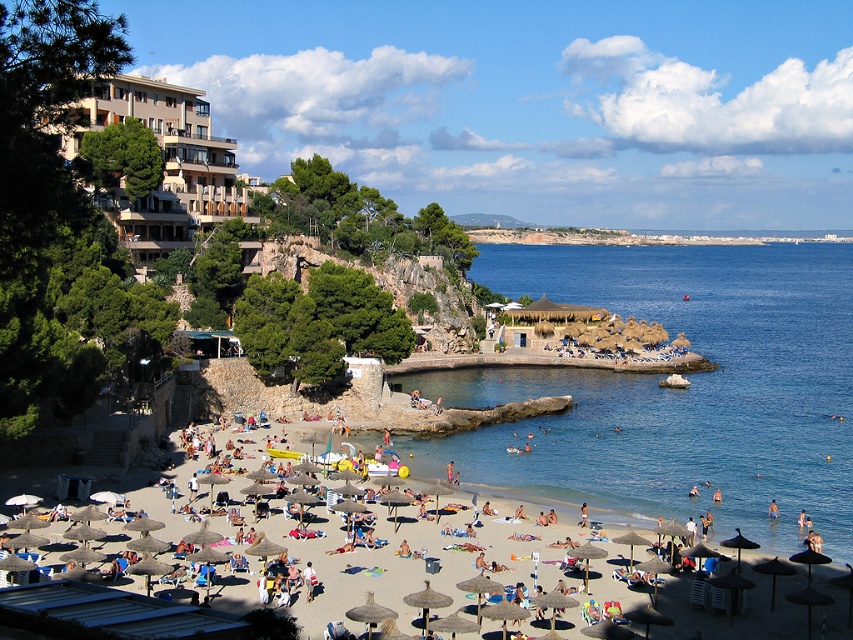
Question: Which object is farther from the camera taking this photo?

Choices:
 (A) beige sand beach at lower center
 (B) beige concrete building at upper left
 (C) blue water at beach center

Answer: (C)

Question: Which of the following is the farthest from the observer?

Choices:
 (A) (822, 486)
 (B) (735, 524)

Answer: (A)

Question: Does beige concrete building at upper left appear on the right side of beige sand beach at lower center?

Choices:
 (A) no
 (B) yes

Answer: (A)

Question: Which object is farther from the camera taking this photo?

Choices:
 (A) beige concrete building at upper left
 (B) blue water at beach center

Answer: (B)

Question: Is beige concrete building at upper left to the left of beige sand beach at lower center from the viewer's perspective?

Choices:
 (A) no
 (B) yes

Answer: (B)

Question: In this image, where is blue water at beach center located relative to beige concrete building at upper left?

Choices:
 (A) below
 (B) above

Answer: (A)